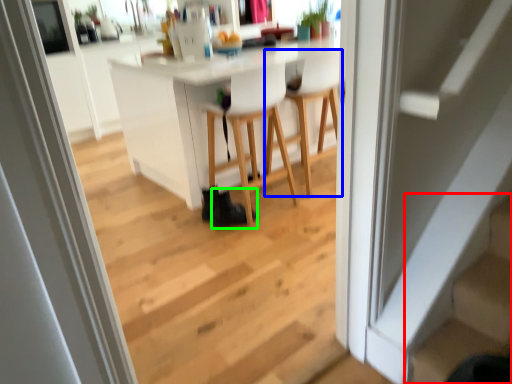
Question: Which object is the farthest from stairs (highlighted by a red box)? Choose among these: chair (highlighted by a blue box) or shoe (highlighted by a green box).

Choices:
 (A) chair
 (B) shoe

Answer: (A)